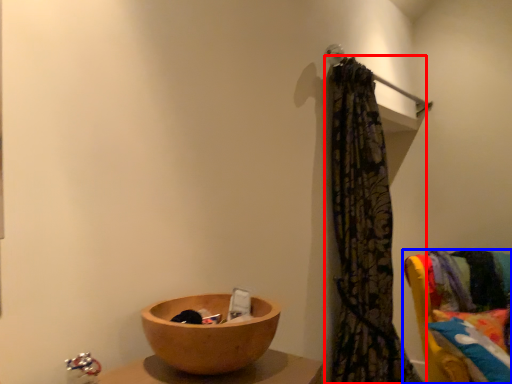
Question: Which point is closer to the camera, curtain (highlighted by a red box) or furniture (highlighted by a blue box)?

Choices:
 (A) curtain
 (B) furniture

Answer: (A)